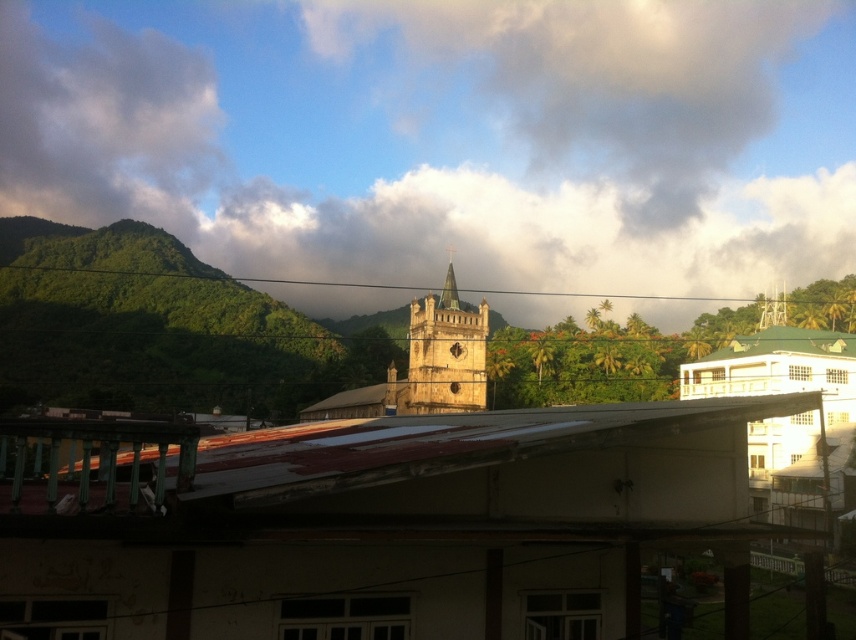
Which of these two, white fluffy cloud at upper center or cloudy sky at upper center, stands shorter?

Standing shorter between the two is cloudy sky at upper center.

Who is more distant from viewer, [525,51] or [506,4]?

Point [506,4]

The width and height of the screenshot is (856, 640). I want to click on white fluffy cloud at upper center, so click(446, 134).

Which is above, white fluffy cloud at upper center or golden stone clock tower at center?

white fluffy cloud at upper center

Who is positioned more to the left, white fluffy cloud at upper center or golden stone clock tower at center?

From the viewer's perspective, white fluffy cloud at upper center appears more on the left side.

Identify the location of white fluffy cloud at upper center. The image size is (856, 640). (446, 134).

Locate an element on the screen. white fluffy cloud at upper center is located at coordinates (446, 134).

Find the location of a particular element. This screenshot has width=856, height=640. golden stone church at center is located at coordinates (423, 369).

Is golden stone church at center above golden stone clock tower at center?

Incorrect, golden stone church at center is not positioned above golden stone clock tower at center.

What do you see at coordinates (423, 369) in the screenshot?
I see `golden stone church at center` at bounding box center [423, 369].

Find the location of a particular element. golden stone church at center is located at coordinates (423, 369).